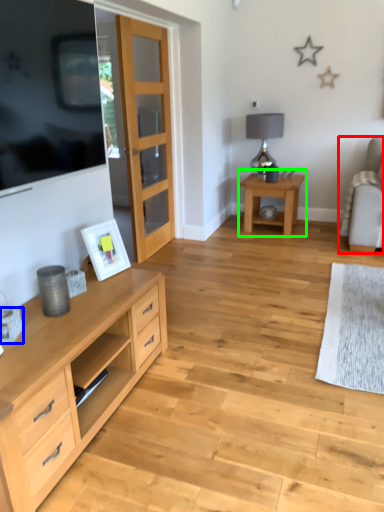
Question: Estimate the real-world distances between objects in this image. Which object is closer to chair (highlighted by a red box), coffee cup (highlighted by a blue box) or table (highlighted by a green box)?

Choices:
 (A) coffee cup
 (B) table

Answer: (B)